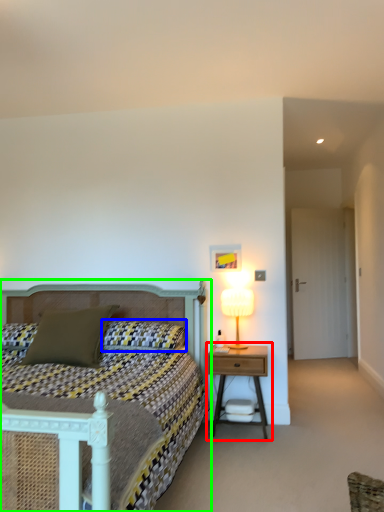
Question: Based on their relative distances, which object is farther from nightstand (highlighted by a red box)? Choose from pillow (highlighted by a blue box) and bed (highlighted by a green box).

Choices:
 (A) pillow
 (B) bed

Answer: (B)